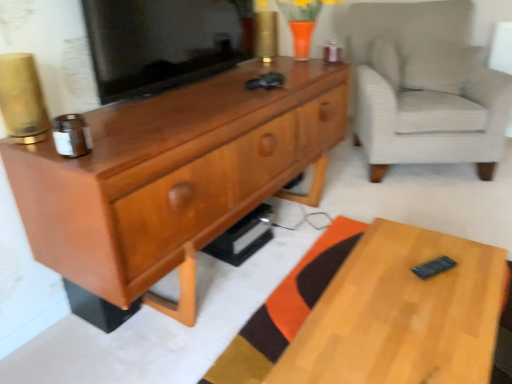
The height and width of the screenshot is (384, 512). Describe the element at coordinates (174, 176) in the screenshot. I see `matte wood cabinet at center` at that location.

Find the location of a particular element. matte wood cabinet at center is located at coordinates tap(174, 176).

What is the approximate height of matte black tv at center?

The height of matte black tv at center is 13.07 inches.

The width and height of the screenshot is (512, 384). Identify the location of matte wood cabinet at center. click(x=174, y=176).

Considering the relative sizes of matte black tv at center and light gray textured armchair at right in the image provided, is matte black tv at center smaller than light gray textured armchair at right?

Correct, matte black tv at center occupies less space than light gray textured armchair at right.

From the image's perspective, between matte black tv at center and light gray textured armchair at right, which one is located above?

light gray textured armchair at right, from the image's perspective.

Can you confirm if matte black tv at center is taller than light gray textured armchair at right?

No.

Considering the positions of points (424, 10) and (144, 192), is point (424, 10) farther from camera compared to point (144, 192)?

Yes, it is behind point (144, 192).

From a real-world perspective, between light gray textured armchair at right and matte wood cabinet at center, who is vertically lower?

matte wood cabinet at center, from a real-world perspective.

In the image, there is a light gray textured armchair at right. Identify the location of cabinetry below it (from the image's perspective). Image resolution: width=512 pixels, height=384 pixels. (174, 176).

Is light gray textured armchair at right surrounding matte wood cabinet at center?

Definitely not — matte wood cabinet at center is not inside light gray textured armchair at right.

Which object is thinner, light gray textured armchair at right or light wood desk at lower right?

light wood desk at lower right.

Considering the points (475, 95) and (411, 353), which point is behind, point (475, 95) or point (411, 353)?

Point (475, 95)

Consider the image. Is light gray textured armchair at right positioned far away from light wood desk at lower right?

light gray textured armchair at right is positioned a significant distance from light wood desk at lower right.

From the picture: How different are the orientations of light gray textured armchair at right and light wood desk at lower right in degrees?

The facing directions of light gray textured armchair at right and light wood desk at lower right are 61.3 degrees apart.

From the image's perspective, is light wood desk at lower right above or below light gray textured armchair at right?

Clearly, from the image's perspective, light wood desk at lower right is below light gray textured armchair at right.

In the image, is light wood desk at lower right on the left side or the right side of light gray textured armchair at right?

light wood desk at lower right is to the left of light gray textured armchair at right.

Considering their positions, is light wood desk at lower right located in front of or behind light gray textured armchair at right?

light wood desk at lower right is positioned closer to the viewer than light gray textured armchair at right.

From a real-world perspective, is light wood desk at lower right beneath light gray textured armchair at right?

Indeed, from a real-world perspective, light wood desk at lower right is positioned beneath light gray textured armchair at right.

Does light wood desk at lower right have a larger size compared to matte wood cabinet at center?

No.

Is light wood desk at lower right turned away from matte wood cabinet at center?

Yes, matte wood cabinet at center is at the back of light wood desk at lower right.

Which is behind, point (344, 348) or point (38, 241)?

Positioned behind is point (38, 241).

Is light wood desk at lower right wider than matte wood cabinet at center?

Correct, the width of light wood desk at lower right exceeds that of matte wood cabinet at center.

Locate an element on the screen. The image size is (512, 384). desk located underneath the matte black tv at center (from a real-world perspective) is located at coordinates (402, 314).

Is matte black tv at center oriented away from light wood desk at lower right?

No, matte black tv at center is not facing away from light wood desk at lower right.

Based on the photo, is matte black tv at center taller or shorter than light wood desk at lower right?

In the image, matte black tv at center appears to be taller than light wood desk at lower right.

From the image's perspective, is matte black tv at center above or below matte wood cabinet at center?

From the image's perspective, matte black tv at center appears above matte wood cabinet at center.

Looking at this image, is matte black tv at center further to the viewer compared to matte wood cabinet at center?

Yes, the depth of matte black tv at center is greater than that of matte wood cabinet at center.

Who is smaller, matte black tv at center or matte wood cabinet at center?

With smaller size is matte black tv at center.

Identify the location of chair on the right of matte black tv at center. (401, 92).

Image resolution: width=512 pixels, height=384 pixels. What are the coordinates of `cabinetry below the light gray textured armchair at right (from a real-world perspective)` in the screenshot? It's located at (174, 176).

Considering their positions, is light gray textured armchair at right positioned further to light wood desk at lower right than matte black tv at center?

Based on the image, light gray textured armchair at right appears to be further to light wood desk at lower right.

Which object lies nearer to the anchor point light gray textured armchair at right, matte black tv at center or light wood desk at lower right?

matte black tv at center is closer to light gray textured armchair at right.

Looking at the image, which one is located further to light gray textured armchair at right, matte wood cabinet at center or matte black tv at center?

matte black tv at center is positioned further to the anchor light gray textured armchair at right.

Based on the photo, which object lies further to the anchor point matte wood cabinet at center, light gray textured armchair at right or light wood desk at lower right?

light gray textured armchair at right lies further to matte wood cabinet at center than the other object.

Looking at the image, which one is located closer to matte black tv at center, matte wood cabinet at center or light wood desk at lower right?

matte wood cabinet at center is closer to matte black tv at center.

Based on their spatial positions, is matte black tv at center or matte wood cabinet at center further from light wood desk at lower right?

Among the two, matte black tv at center is located further to light wood desk at lower right.

Which object lies nearer to the anchor point matte black tv at center, light gray textured armchair at right or light wood desk at lower right?

Based on the image, light wood desk at lower right appears to be nearer to matte black tv at center.

Based on their spatial positions, is light wood desk at lower right or matte black tv at center closer to matte wood cabinet at center?

matte black tv at center is positioned closer to the anchor matte wood cabinet at center.

Locate an element on the screen. The height and width of the screenshot is (384, 512). desk between matte black tv at center and light gray textured armchair at right from left to right is located at coordinates (402, 314).

This screenshot has height=384, width=512. What are the coordinates of `cabinetry between matte black tv at center and light gray textured armchair at right from left to right` in the screenshot? It's located at (174, 176).

Identify the location of cabinetry between matte black tv at center and light wood desk at lower right in the up-down direction. (174, 176).

Identify the location of cabinetry between light wood desk at lower right and light gray textured armchair at right from front to back. (174, 176).